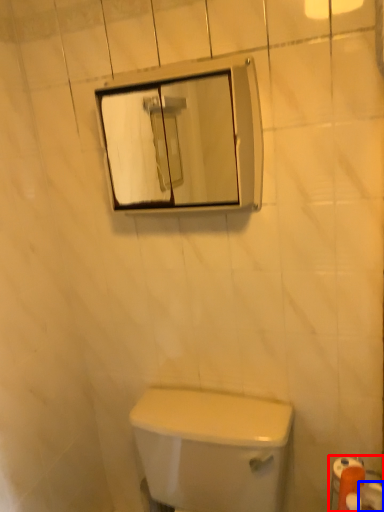
Question: Among these objects, which one is farthest to the camera, toilet paper (highlighted by a red box) or toilet paper (highlighted by a blue box)?

Choices:
 (A) toilet paper
 (B) toilet paper

Answer: (A)